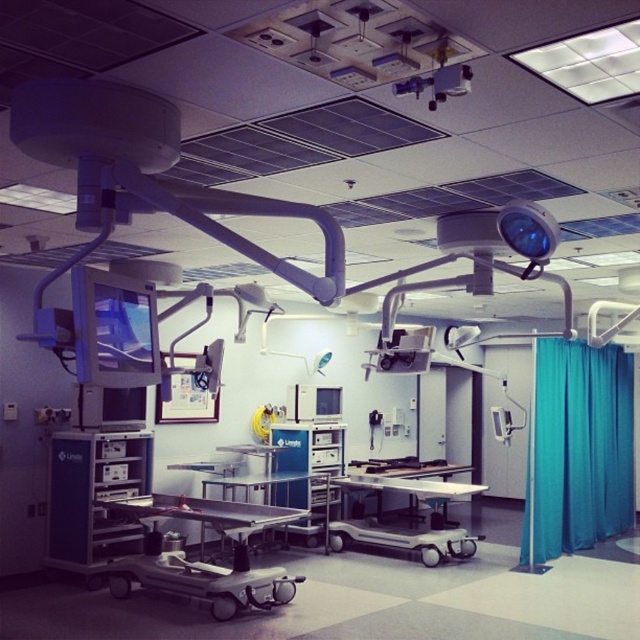
Is teal fabric curtain at right to the left of metallic stainless steel surgical table at center from the viewer's perspective?

In fact, teal fabric curtain at right is to the right of metallic stainless steel surgical table at center.

Who is positioned more to the left, teal fabric curtain at right or metallic stainless steel surgical table at center?

metallic stainless steel surgical table at center

At what (x,y) coordinates should I click in order to perform the action: click on teal fabric curtain at right. Please return your answer as a coordinate pair (x, y). The width and height of the screenshot is (640, 640). Looking at the image, I should click on (580, 445).

Is teal fabric curtain at right smaller than metallic silver cart at center?

No.

Which is behind, point (541, 458) or point (481, 486)?

The point (541, 458) is behind.

Where is `teal fabric curtain at right`? The width and height of the screenshot is (640, 640). teal fabric curtain at right is located at coordinates (580, 445).

Can you confirm if metallic stainless steel surgical table at center is bigger than metallic silver cart at center?

Incorrect, metallic stainless steel surgical table at center is not larger than metallic silver cart at center.

This screenshot has width=640, height=640. I want to click on metallic stainless steel surgical table at center, so click(x=202, y=561).